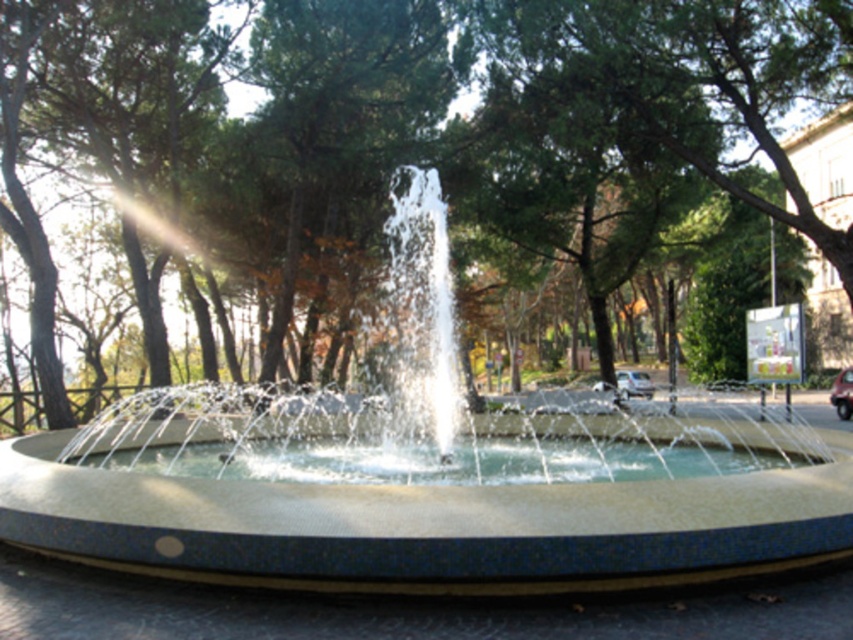
Question: Which point appears closest to the camera in this image?

Choices:
 (A) (612, 61)
 (B) (399, 257)

Answer: (A)

Question: Which object is closer to the camera taking this photo?

Choices:
 (A) white glossy fountain at center
 (B) green leafy tree at center

Answer: (A)

Question: Does white glossy fountain at center appear under green leafy tree at center?

Choices:
 (A) no
 (B) yes

Answer: (B)

Question: Does white glossy fountain at center have a smaller size compared to green leafy tree at center?

Choices:
 (A) yes
 (B) no

Answer: (B)

Question: Is white glossy fountain at center to the left of green leafy tree at center from the viewer's perspective?

Choices:
 (A) yes
 (B) no

Answer: (A)